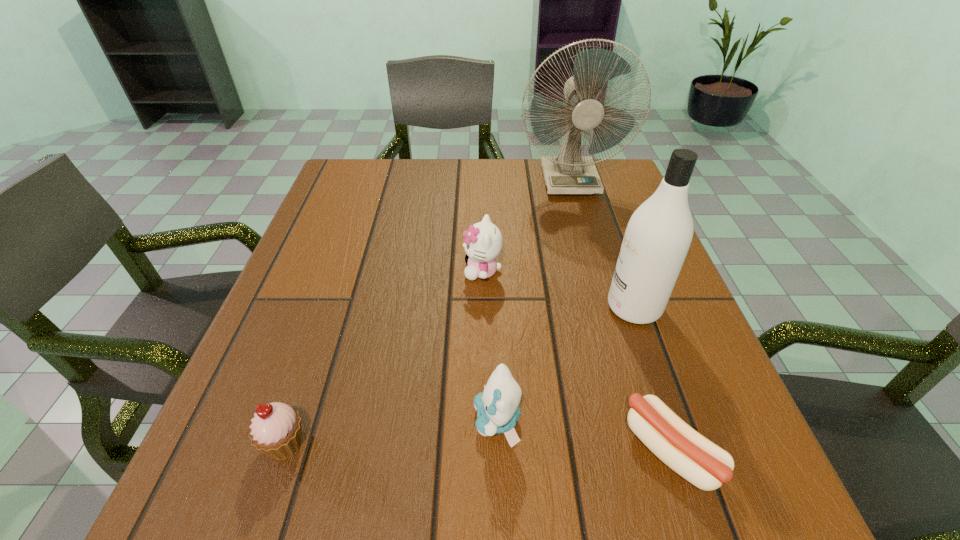
You are a GUI agent. You are given a task and a screenshot of the screen. Output one action in this format:
    pyautogui.click(x=<x>, y=<y>)
    Task: Click on the free location that satisfies the following two spatial constraints: 1. on the front-facing side of the farther kitten; 2. on the right side of the sausage
    The height and width of the screenshot is (540, 960).
    Given the screenshot: What is the action you would take?
    pyautogui.click(x=484, y=451)

The image size is (960, 540). I want to click on vacant space that satisfies the following two spatial constraints: 1. on the front-facing side of the sausage; 2. on the right side of the second farthest object, so click(x=484, y=451).

At what (x,y) coordinates should I click in order to perform the action: click on vacant position in the image that satisfies the following two spatial constraints: 1. on the front-facing side of the shortest object; 2. on the right side of the farther kitten. Please return your answer as a coordinate pair (x, y). The image size is (960, 540). Looking at the image, I should click on (484, 451).

Where is `free point that satisfies the following two spatial constraints: 1. on the face of the nearer kitten; 2. on the left side of the shortest object`? free point that satisfies the following two spatial constraints: 1. on the face of the nearer kitten; 2. on the left side of the shortest object is located at coordinates (498, 451).

Image resolution: width=960 pixels, height=540 pixels. I want to click on free location that satisfies the following two spatial constraints: 1. on the face of the nearer kitten; 2. on the back side of the sausage, so pos(498,451).

Identify the location of vacant space that satisfies the following two spatial constraints: 1. on the face of the shortest object; 2. on the left side of the nearer kitten. The height and width of the screenshot is (540, 960). (498, 451).